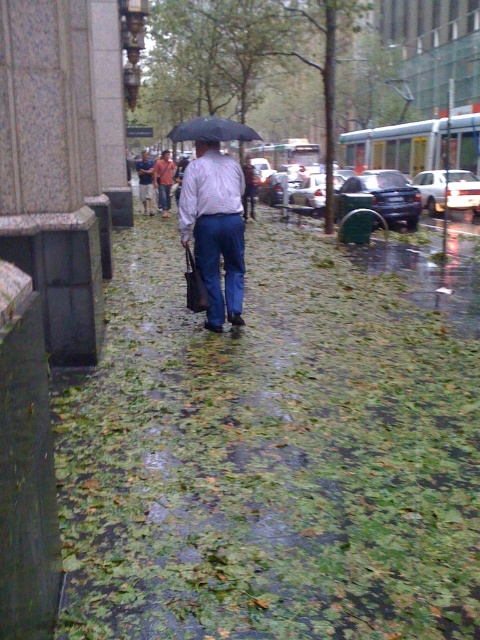
Does matte white shirt at center have a smaller size compared to denim pants at center?

Yes, matte white shirt at center is smaller than denim pants at center.

Can you confirm if matte white shirt at center is shorter than denim pants at center?

Yes.

This screenshot has width=480, height=640. What are the coordinates of `matte white shirt at center` in the screenshot? It's located at (215, 228).

Is point (322, 278) farther from camera compared to point (242, 132)?

Yes, point (322, 278) is behind point (242, 132).

Who is positioned more to the right, green leafy pavement at center or black matte umbrella at center?

green leafy pavement at center is more to the right.

In order to click on green leafy pavement at center in this screenshot , I will do `click(269, 456)`.

Based on the photo, does green leafy pavement at center lie behind matte white shirt at center?

No, it is in front of matte white shirt at center.

Which is in front, point (296, 371) or point (213, 246)?

Point (296, 371) is more forward.

Which is behind, point (226, 632) or point (233, 243)?

The point (233, 243) is more distant.

Image resolution: width=480 pixels, height=640 pixels. I want to click on green leafy pavement at center, so click(269, 456).